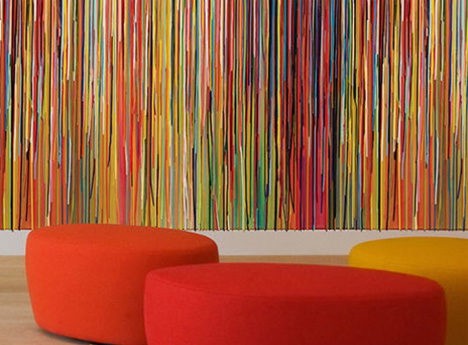
I want to click on right of orange ottoman, so click(225, 253).